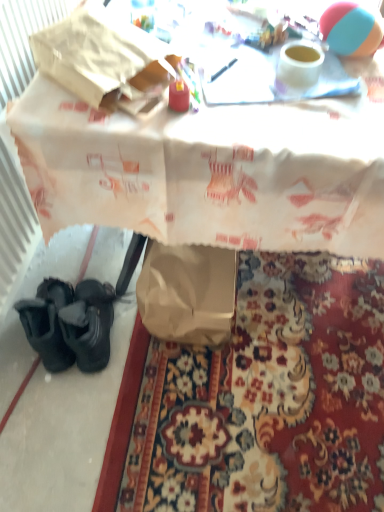
Find the location of a particular element. The image size is (384, 512). free space to the left of rubber beach ball at upper right is located at coordinates (282, 62).